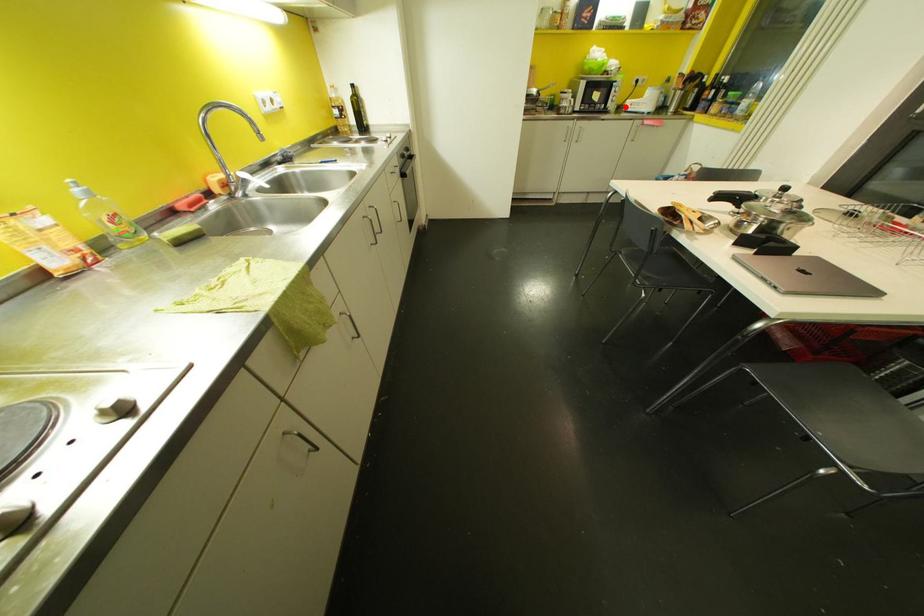
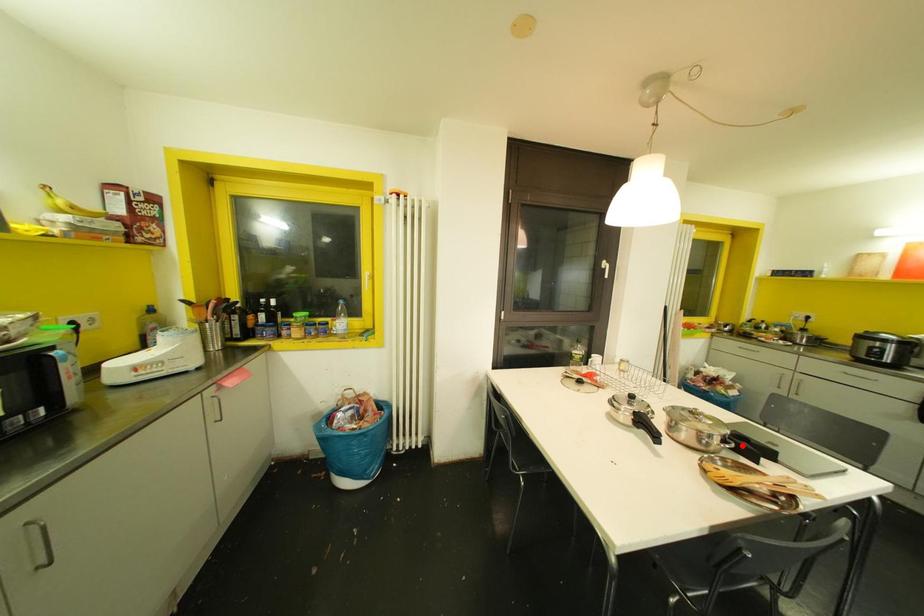
I am providing you with two images of the same scene from different viewpoints. A red point is marked on the first image and another point is marked on the second image. Are the points marked in image1 and image2 representing the same 3D position?

No